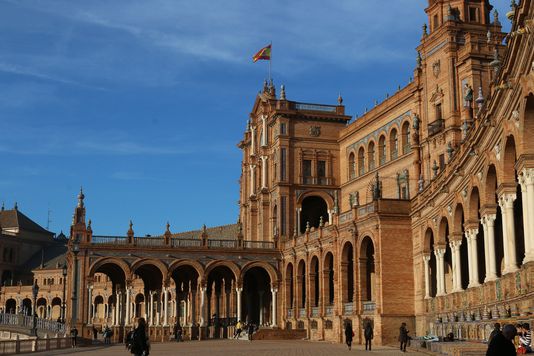
Identify the location of windows. (407, 138), (395, 144), (383, 151), (370, 153), (362, 157), (351, 165), (321, 169), (303, 169), (6, 254), (11, 254).